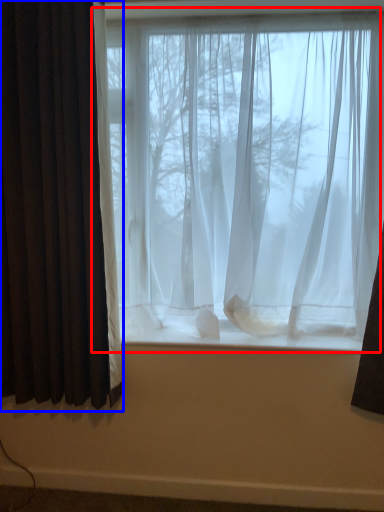
Question: Which of the following is the closest to the observer, window (highlighted by a red box) or curtain (highlighted by a blue box)?

Choices:
 (A) window
 (B) curtain

Answer: (B)